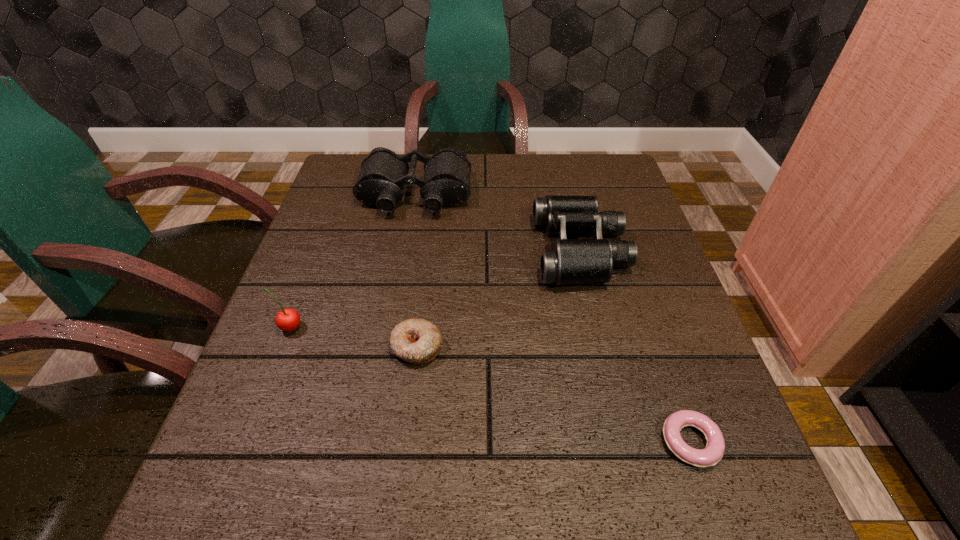
What are the coordinates of `free region at the near edge of the desktop` in the screenshot? It's located at (537, 497).

Find the location of a particular element. This screenshot has height=540, width=960. free space at the left edge of the desktop is located at coordinates (373, 245).

At what (x,y) coordinates should I click in order to perform the action: click on blank space at the right edge. Please return your answer as a coordinate pair (x, y). The height and width of the screenshot is (540, 960). Looking at the image, I should click on coord(624,357).

Where is `vacant space at the near left corner of the desktop`? The width and height of the screenshot is (960, 540). vacant space at the near left corner of the desktop is located at coordinates (289, 531).

Where is `vacant space at the far right corner of the desktop`? vacant space at the far right corner of the desktop is located at coordinates (577, 166).

The height and width of the screenshot is (540, 960). In order to click on vacant space that's between the right binoculars and the left doughnut in this screenshot , I will do `click(499, 298)`.

Find the location of a particular element. This screenshot has height=540, width=960. vacant region between the left binoculars and the leftmost object is located at coordinates (352, 261).

Locate an element on the screen. This screenshot has height=540, width=960. blank region between the farther doughnut and the right binoculars is located at coordinates (499, 298).

The height and width of the screenshot is (540, 960). Find the location of `unoccupied area between the nearest object and the left binoculars`. unoccupied area between the nearest object and the left binoculars is located at coordinates (553, 319).

Locate an element on the screen. The image size is (960, 540). free space that is in between the left binoculars and the left doughnut is located at coordinates (417, 271).